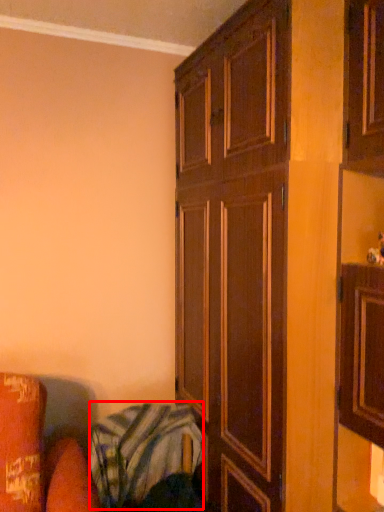
Question: Where is blanket (annotated by the red box) located in relation to cupboard in the image?

Choices:
 (A) right
 (B) left

Answer: (B)